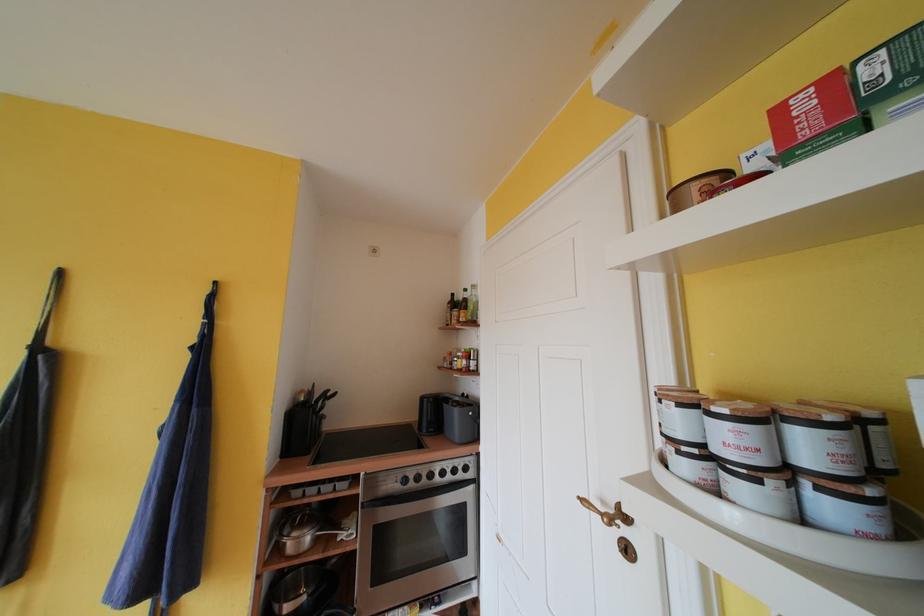
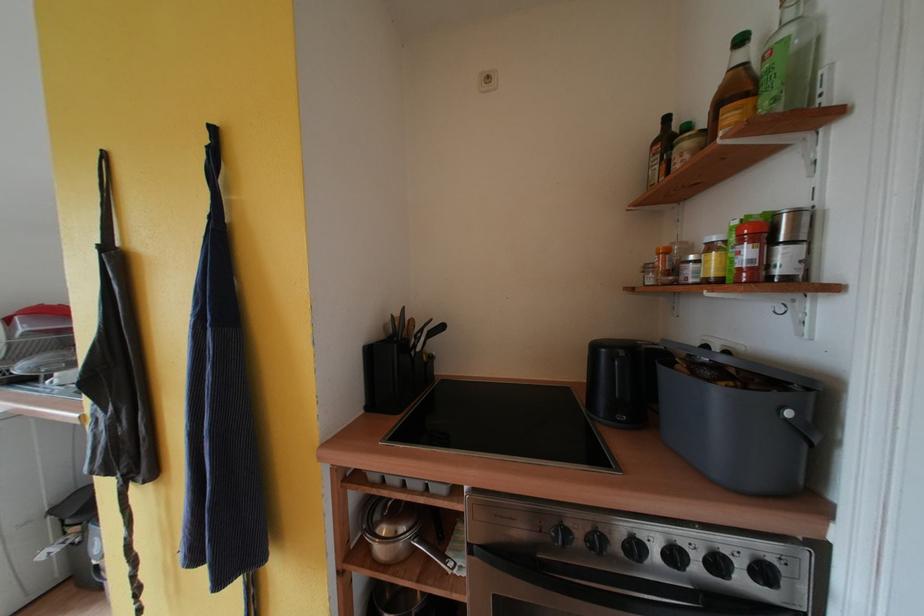
In the second image, find the point that corresponds to point 460,474 in the first image.

(723, 567)